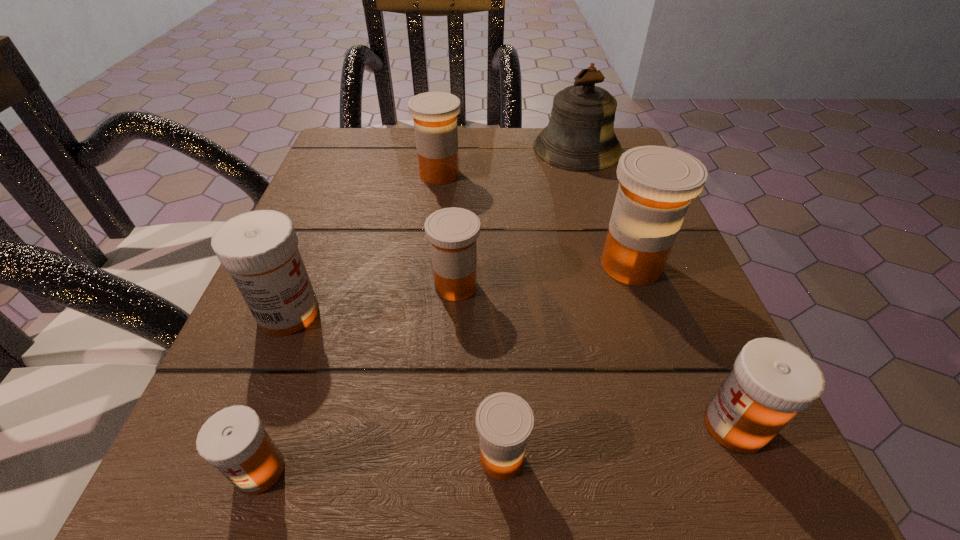
This screenshot has height=540, width=960. Identify the location of vacant space located on the front of the bell. (618, 279).

Locate an element on the screen. The width and height of the screenshot is (960, 540). vacant space situated on the label of the rightmost orange medicine is located at coordinates (360, 265).

The image size is (960, 540). I want to click on vacant space located 0.280m on the label of the rightmost orange medicine, so click(x=422, y=265).

Where is `vacant space situated on the label of the rightmost orange medicine`? vacant space situated on the label of the rightmost orange medicine is located at coordinates (397, 265).

Locate an element on the screen. Image resolution: width=960 pixels, height=540 pixels. vacant space located 0.270m on the label of the second biggest orange medicine is located at coordinates (594, 174).

You are a GUI agent. You are given a task and a screenshot of the screen. Output one action in this format:
    pyautogui.click(x=<x>, y=<y>)
    Task: Click on the vacant position located 0.220m on the front of the biggest white medicine
    This screenshot has height=540, width=960.
    Given the screenshot: What is the action you would take?
    pyautogui.click(x=209, y=512)

Locate an element on the screen. Image resolution: width=960 pixels, height=540 pixels. vacant space located 0.330m on the label of the second smallest orange medicine is located at coordinates (695, 286).

At what (x,y) coordinates should I click in order to perform the action: click on vacant space located on the left of the second biggest white medicine. Please return your answer as a coordinate pair (x, y). This screenshot has height=540, width=960. Looking at the image, I should click on (464, 426).

You are a GUI agent. You are given a task and a screenshot of the screen. Output one action in this format:
    pyautogui.click(x=<x>, y=<y>)
    Task: Click on the free spot located on the label of the nearest orange medicine
    Image resolution: width=960 pixels, height=540 pixels.
    Given the screenshot: What is the action you would take?
    pyautogui.click(x=324, y=458)

The image size is (960, 540). I want to click on vacant point located on the label of the nearest orange medicine, so click(224, 458).